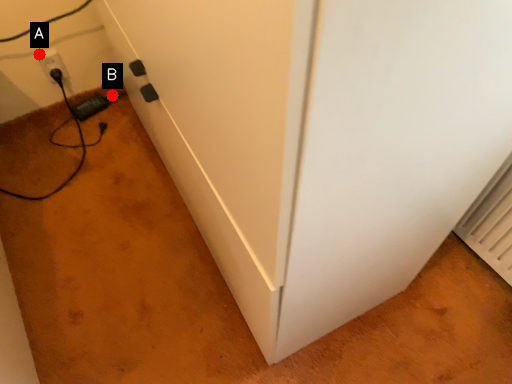
Question: Two points are circled on the image, labeled by A and B beside each circle. Which point is closer to the camera?

Choices:
 (A) A is closer
 (B) B is closer

Answer: (A)